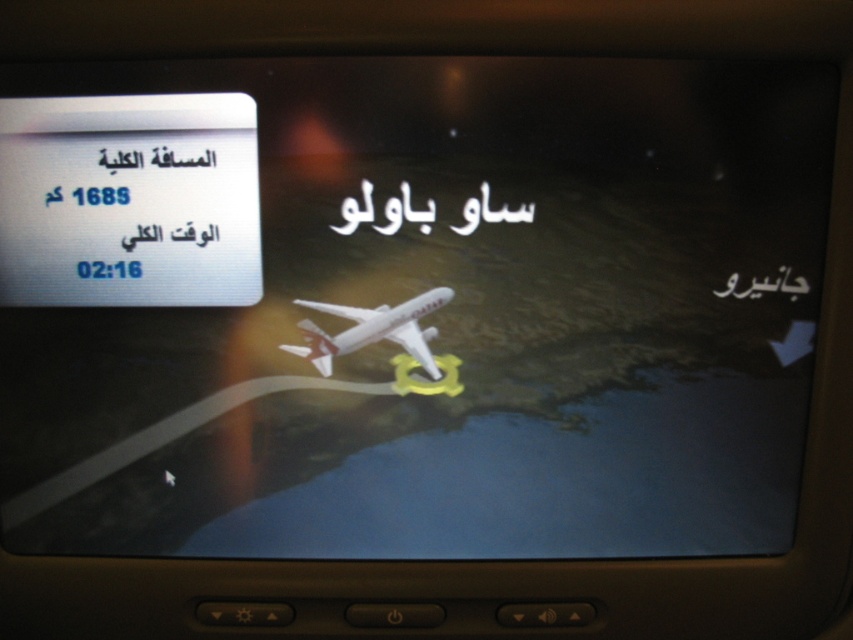
Does white matte airplane at center appear over black paper text at upper center?

No, white matte airplane at center is not above black paper text at upper center.

Is point (432, 369) in front of point (405, 182)?

No, (432, 369) is behind (405, 182).

At what (x,y) coordinates should I click in order to perform the action: click on white matte airplane at center. Please return your answer as a coordinate pair (x, y). Looking at the image, I should click on (372, 330).

Can you confirm if white paper at upper left is wider than black paper text at upper center?

Correct, the width of white paper at upper left exceeds that of black paper text at upper center.

Who is shorter, white paper at upper left or black paper text at upper center?

With less height is black paper text at upper center.

The height and width of the screenshot is (640, 853). What are the coordinates of `white paper at upper left` in the screenshot? It's located at (x=126, y=204).

At what (x,y) coordinates should I click in order to perform the action: click on white paper at upper left. Please return your answer as a coordinate pair (x, y). This screenshot has width=853, height=640. Looking at the image, I should click on (126, 204).

Between point (230, 173) and point (722, 296), which one is positioned behind?

Point (722, 296)

Describe the element at coordinates (126, 204) in the screenshot. This screenshot has height=640, width=853. I see `white paper at upper left` at that location.

Find the location of `white paper at upper left`. white paper at upper left is located at coordinates (126, 204).